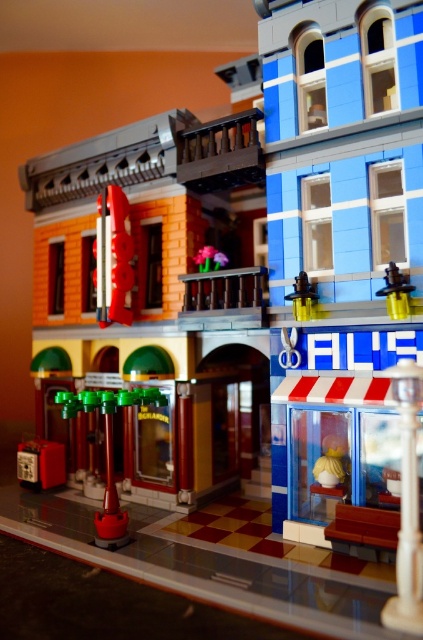
You are a pedestrian standing on the LEGO street. You see the green plastic street lamp at lower left and the yellow plastic toy at upper right. Which object is higher up in the scene?

The yellow plastic toy at upper right is higher up in the scene than the green plastic street lamp at lower left.

You are a delivery drone flying above the LEGO street scene. You need to drop a package at the location marked by point (88,406) and then proceed to point (400,291). According to the spatial relationship between these two points, which point should you visit first?

You should visit point (88,406) first because it is behind point (400,291). Since you are flying above, you would reach the closer point first before moving to the one behind it.